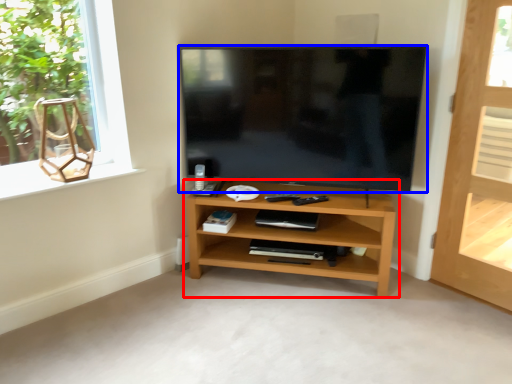
Question: Which object is further to the camera taking this photo, shelf (highlighted by a red box) or television (highlighted by a blue box)?

Choices:
 (A) shelf
 (B) television

Answer: (A)